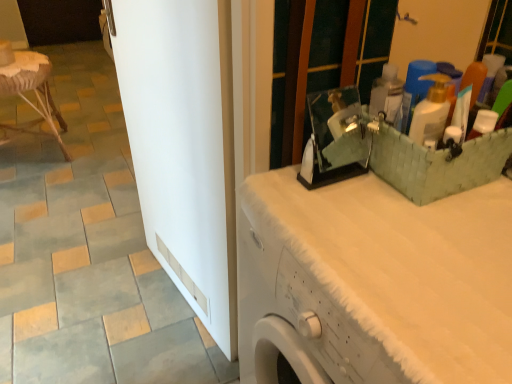
The height and width of the screenshot is (384, 512). In order to click on blank space situated above white textured counter top at upper right (from a real-world perspective) in this screenshot , I will do `click(409, 228)`.